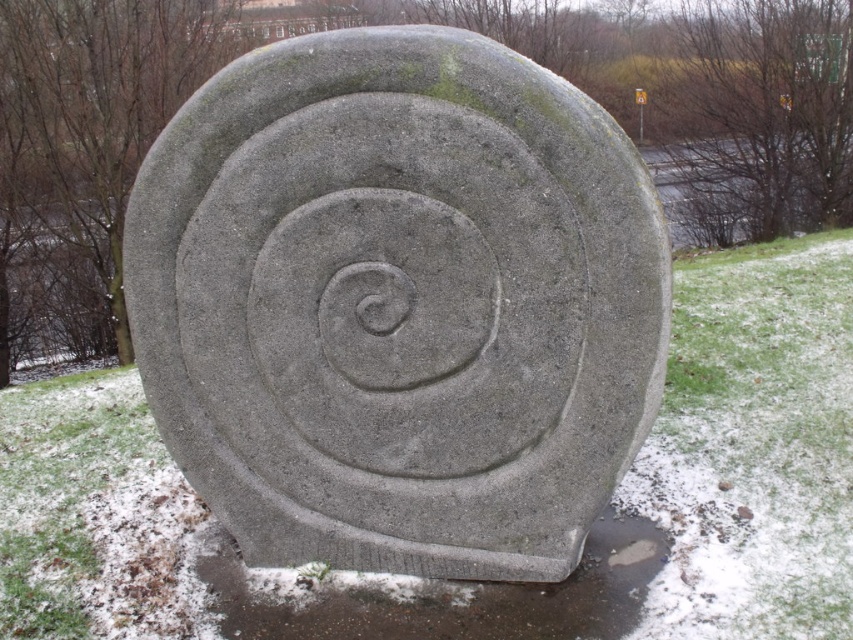
Question: Which point is farther from the camera taking this photo?

Choices:
 (A) (244, 637)
 (B) (405, 216)

Answer: (A)

Question: Is gray concrete spiral at center behind slick concrete puddle at lower center?

Choices:
 (A) yes
 (B) no

Answer: (B)

Question: Is gray concrete spiral at center bigger than slick concrete puddle at lower center?

Choices:
 (A) yes
 (B) no

Answer: (A)

Question: Where is gray concrete spiral at center located in relation to slick concrete puddle at lower center in the image?

Choices:
 (A) left
 (B) right

Answer: (A)

Question: Which point is farther from the camera taking this photo?

Choices:
 (A) (378, 374)
 (B) (556, 604)

Answer: (B)